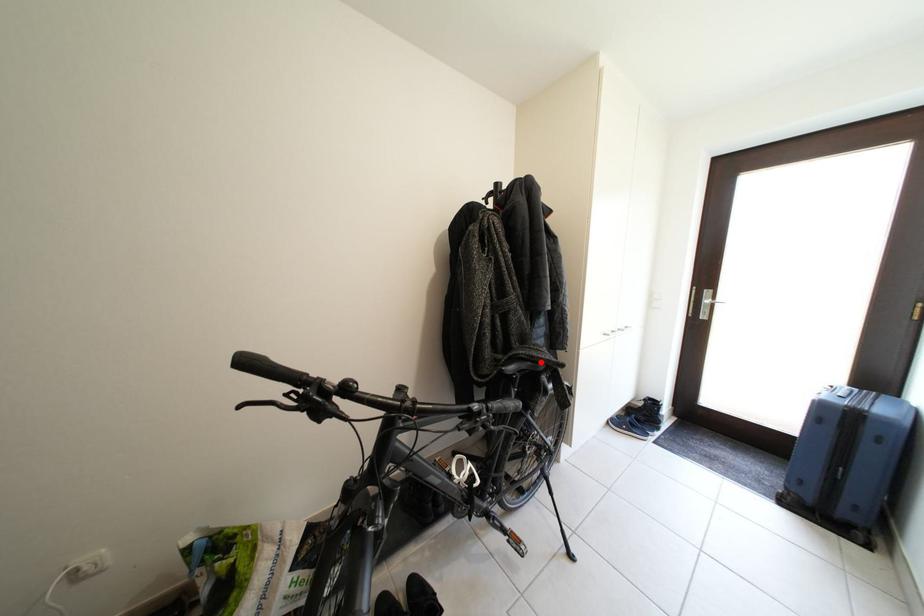
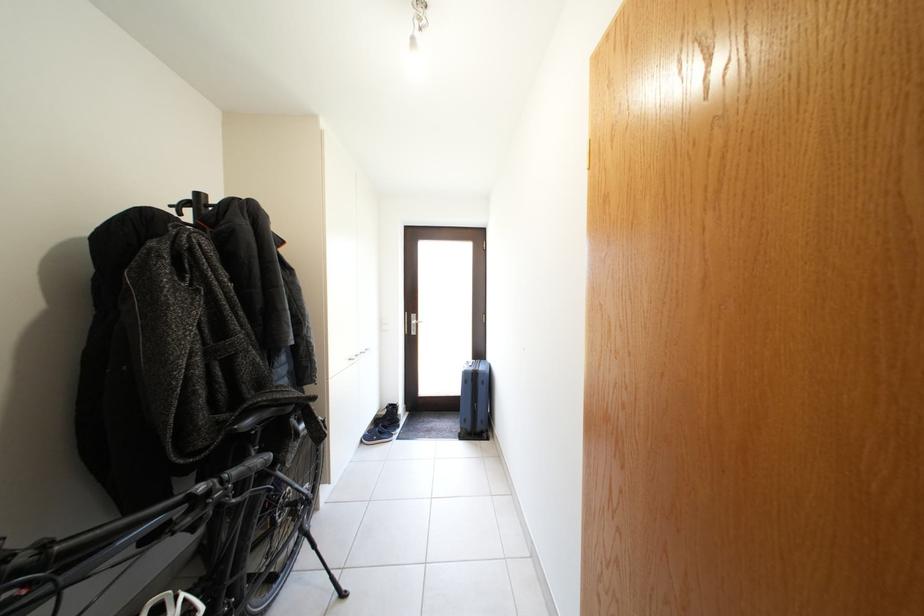
Find the pixel in the second image that matches the highlighted location in the first image.

(286, 406)